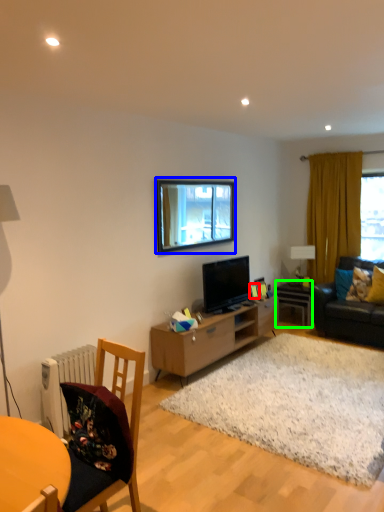
Question: Which is farther away from picture frame (highlighted by a red box)? window (highlighted by a blue box) or table (highlighted by a green box)?

Choices:
 (A) window
 (B) table

Answer: (A)